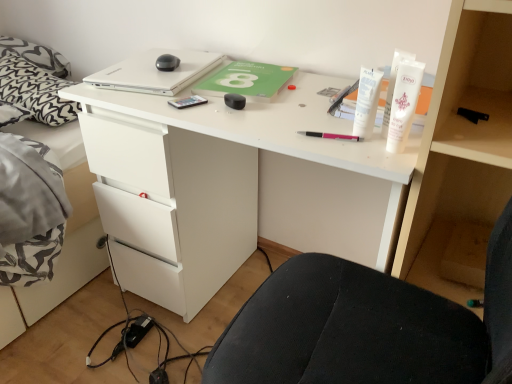
This screenshot has height=384, width=512. Describe the element at coordinates (234, 101) in the screenshot. I see `black rubberized mouse at center, arranged as the 3th stationery when viewed from the right` at that location.

Locate an element on the screen. The image size is (512, 384). white matte laptop at upper center is located at coordinates (156, 72).

This screenshot has width=512, height=384. Describe the element at coordinates (65, 234) in the screenshot. I see `gray fabric bed at left` at that location.

The image size is (512, 384). What do you see at coordinates (402, 103) in the screenshot? I see `white matte tube at upper right, which is the first toiletry from right to left` at bounding box center [402, 103].

This screenshot has width=512, height=384. I want to click on black rubberized mouse at center, which is counted as the second stationery, starting from the back, so click(x=234, y=101).

Does black rubberized mouse at center, arranged as the 3th stationery when viewed from the right, have a lesser width compared to matte white bookshelf at right?

Yes.

Measure the distance from black rubberized mouse at center, the 3th stationery in the front-to-back sequence, to matte white bookshelf at right.

The distance of black rubberized mouse at center, the 3th stationery in the front-to-back sequence, from matte white bookshelf at right is 53.75 centimeters.

Would you say matte white bookshelf at right is part of black rubberized mouse at center, the 3th stationery in the front-to-back sequence,'s contents?

No, matte white bookshelf at right is not inside black rubberized mouse at center, the 3th stationery in the front-to-back sequence.

Which is closer, (243,98) or (481,41)?

The point (481,41) is closer.

Considering the relative sizes of white matte desk at center and gray fabric bed at left in the image provided, is white matte desk at center taller than gray fabric bed at left?

Yes, white matte desk at center is taller than gray fabric bed at left.

In the image, is white matte desk at center on the left side or the right side of gray fabric bed at left?

In the image, white matte desk at center appears on the right side of gray fabric bed at left.

Are white matte desk at center and gray fabric bed at left far apart?

No, white matte desk at center is not far from gray fabric bed at left.

Could gray fabric bed at left be considered to be inside white matte desk at center?

Definitely not — gray fabric bed at left is not inside white matte desk at center.

Image resolution: width=512 pixels, height=384 pixels. I want to click on the 2nd toiletry located above the black plastic pen at upper right, which is the 4th stationery in left-to-right order (from a real-world perspective), so click(402, 103).

Between white matte tube at upper right, which is the first toiletry from right to left, and black plastic pen at upper right, placed as the fourth stationery when sorted from back to front, which one is positioned in front?

Positioned in front is white matte tube at upper right, which is the first toiletry from right to left.

Who is bigger, white matte tube at upper right, which is the first toiletry from right to left, or black plastic pen at upper right, the 1th stationery viewed from the front?

white matte tube at upper right, which is the first toiletry from right to left, is bigger.

Is white matte tube at upper right, arranged as the second toiletry when viewed from the left, completely or partially outside of black plastic pen at upper right, placed as the fourth stationery when sorted from back to front?

Yes, white matte tube at upper right, arranged as the second toiletry when viewed from the left, is not within black plastic pen at upper right, placed as the fourth stationery when sorted from back to front.

Considering the positions of objects black plastic pen at upper right, placed as the fourth stationery when sorted from back to front, and white matte tube at upper right, the second toiletry viewed from the right, in the image provided, who is more to the left, black plastic pen at upper right, placed as the fourth stationery when sorted from back to front, or white matte tube at upper right, the second toiletry viewed from the right,?

From the viewer's perspective, white matte tube at upper right, the second toiletry viewed from the right, appears more on the left side.

Is black plastic pen at upper right, placed as the fourth stationery when sorted from back to front, wider than white matte tube at upper right, the 1th toiletry in the left-to-right sequence?

Yes, black plastic pen at upper right, placed as the fourth stationery when sorted from back to front, is wider than white matte tube at upper right, the 1th toiletry in the left-to-right sequence.

Is black plastic pen at upper right, which is the 4th stationery in left-to-right order, further to the viewer compared to white matte tube at upper right, the second toiletry viewed from the right?

Yes, it is.

Does point (476, 111) come farther from viewer compared to point (368, 98)?

Yes, it is behind point (368, 98).

Identify the location of desk below the white matte laptop at upper center (from the image's perspective). The image size is (512, 384). (233, 186).

Between point (186, 81) and point (212, 253), which one is positioned in front?

Point (186, 81)

Between white matte laptop at upper center and white matte desk at center, which one has more height?

white matte desk at center.

From the image's perspective, which one is positioned lower, white matte laptop at upper center or white matte desk at center?

white matte desk at center is shown below in the image.

Is black plastic pen at upper right, which is the 4th stationery in left-to-right order, at the left side of gray fabric bed at left?

In fact, black plastic pen at upper right, which is the 4th stationery in left-to-right order, is to the right of gray fabric bed at left.

Is point (479, 113) less distant than point (73, 236)?

Yes, it is.

How much distance is there between black plastic pen at upper right, which ranks as the first stationery in right-to-left order, and gray fabric bed at left?

black plastic pen at upper right, which ranks as the first stationery in right-to-left order, and gray fabric bed at left are 4.42 feet apart.

Is black plastic pen at upper right, which is the 4th stationery in left-to-right order, with gray fabric bed at left?

black plastic pen at upper right, which is the 4th stationery in left-to-right order, and gray fabric bed at left are not in contact.

Does matte white bookshelf at right have a lesser width compared to white matte tube at upper right, the second toiletry viewed from the right?

No, matte white bookshelf at right is not thinner than white matte tube at upper right, the second toiletry viewed from the right.

Looking at the image, does matte white bookshelf at right seem bigger or smaller compared to white matte tube at upper right, the 1th toiletry in the left-to-right sequence?

Clearly, matte white bookshelf at right is larger in size than white matte tube at upper right, the 1th toiletry in the left-to-right sequence.

Locate an element on the screen. This screenshot has width=512, height=384. the 3rd stationery behind the matte white bookshelf at right is located at coordinates (234, 101).

At what (x,y) coordinates should I click in order to perform the action: click on desk located above the gray fabric bed at left (from a real-world perspective). Please return your answer as a coordinate pair (x, y). Looking at the image, I should click on coord(233,186).

Looking at the image, which one is located closer to matte white bookshelf at right, pink plastic pen at center, acting as the 3th stationery starting from the back, or white matte laptop at upper center?

Among the two, pink plastic pen at center, acting as the 3th stationery starting from the back, is located nearer to matte white bookshelf at right.

Looking at the image, which one is located further to gray fabric bed at left, black rubberized mouse at center, arranged as the 3th stationery when viewed from the right, or white matte laptop at upper center?

The object further to gray fabric bed at left is black rubberized mouse at center, arranged as the 3th stationery when viewed from the right.

When comparing their distances from black rubberized mouse at center, arranged as the 3th stationery when viewed from the right, does pink plastic pen at center, the second stationery when ordered from front to back, or white matte laptop at upper center seem closer?

Based on the image, pink plastic pen at center, the second stationery when ordered from front to back, appears to be nearer to black rubberized mouse at center, arranged as the 3th stationery when viewed from the right.

Estimate the real-world distances between objects in this image. Which object is further from matte white bookshelf at right, black rubberized mouse at center, the 3th stationery in the front-to-back sequence, or white matte desk at center?

The object further to matte white bookshelf at right is black rubberized mouse at center, the 3th stationery in the front-to-back sequence.

From the image, which object appears to be nearer to white matte tube at upper right, arranged as the second toiletry when viewed from the left, gray fabric bed at left or white matte desk at center?

The object closer to white matte tube at upper right, arranged as the second toiletry when viewed from the left, is white matte desk at center.

Estimate the real-world distances between objects in this image. Which object is further from white matte laptop at upper center, gray fabric bed at left or black plastic pen at upper right, which ranks as the first stationery in right-to-left order?

black plastic pen at upper right, which ranks as the first stationery in right-to-left order, lies further to white matte laptop at upper center than the other object.

Estimate the real-world distances between objects in this image. Which object is closer to black plastic pen at upper right, placed as the fourth stationery when sorted from back to front, satin silver phone at center, which is the fourth stationery from right to left, or gray fabric bed at left?

satin silver phone at center, which is the fourth stationery from right to left, is positioned closer to the anchor black plastic pen at upper right, placed as the fourth stationery when sorted from back to front.

When comparing their distances from black rubberized mouse at center, arranged as the 3th stationery when viewed from the right, does satin silver phone at center, the 1th stationery when ordered from back to front, or gray fabric bed at left seem closer?

satin silver phone at center, the 1th stationery when ordered from back to front, is closer to black rubberized mouse at center, arranged as the 3th stationery when viewed from the right.

I want to click on desk between satin silver phone at center, positioned as the 1th stationery in left-to-right order, and black plastic pen at upper right, which is the 4th stationery in left-to-right order, in the horizontal direction, so click(x=233, y=186).

Locate an element on the screen. desk between gray fabric bed at left and matte white bookshelf at right in the horizontal direction is located at coordinates (233, 186).

This screenshot has width=512, height=384. Find the location of `desk located between black rubberized mouse at center, which is counted as the second stationery, starting from the back, and white matte tube at upper right, arranged as the second toiletry when viewed from the left, in the left-right direction`. desk located between black rubberized mouse at center, which is counted as the second stationery, starting from the back, and white matte tube at upper right, arranged as the second toiletry when viewed from the left, in the left-right direction is located at coordinates (233, 186).

I want to click on desk between gray fabric bed at left and white matte tube at upper right, the second toiletry viewed from the right, so click(233, 186).